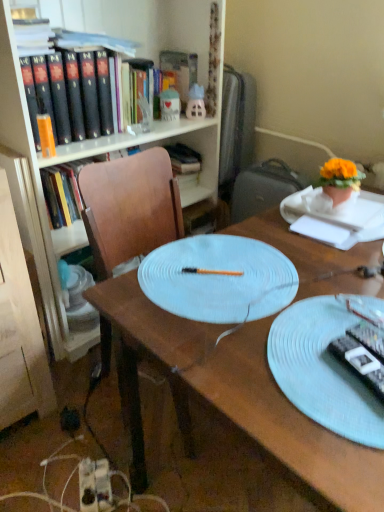
Question: Can you confirm if black plastic remote control at right, the first remote control from the right, is thinner than black plastic remote control at lower right, which appears as the second remote control when viewed from the right?

Choices:
 (A) no
 (B) yes

Answer: (B)

Question: Can you confirm if black plastic remote control at right, the first remote control from the right, is taller than black plastic remote control at lower right, which appears as the second remote control when viewed from the right?

Choices:
 (A) yes
 (B) no

Answer: (A)

Question: Is black plastic remote control at right, arranged as the 2th remote control when viewed from the left, smaller than black plastic remote control at lower right, which appears as the second remote control when viewed from the right?

Choices:
 (A) yes
 (B) no

Answer: (B)

Question: Does black plastic remote control at right, the first remote control from the right, lie in front of black plastic remote control at lower right, the 1th remote control positioned from the left?

Choices:
 (A) no
 (B) yes

Answer: (A)

Question: From the image's perspective, is black plastic remote control at right, the first remote control from the right, on black plastic remote control at lower right, the 1th remote control positioned from the left?

Choices:
 (A) no
 (B) yes

Answer: (B)

Question: Is black plastic remote control at right, the first remote control from the right, facing towards black plastic remote control at lower right, which appears as the second remote control when viewed from the right?

Choices:
 (A) no
 (B) yes

Answer: (B)

Question: Is orange fabric flower pot at upper right bigger than wooden desk at center?

Choices:
 (A) yes
 (B) no

Answer: (B)

Question: Is the position of orange fabric flower pot at upper right more distant than that of wooden desk at center?

Choices:
 (A) yes
 (B) no

Answer: (A)

Question: Is orange fabric flower pot at upper right with wooden desk at center?

Choices:
 (A) yes
 (B) no

Answer: (B)

Question: Can you confirm if orange fabric flower pot at upper right is taller than wooden desk at center?

Choices:
 (A) yes
 (B) no

Answer: (B)

Question: Considering the relative sizes of orange fabric flower pot at upper right and wooden desk at center in the image provided, is orange fabric flower pot at upper right wider than wooden desk at center?

Choices:
 (A) yes
 (B) no

Answer: (B)

Question: Can you confirm if orange fabric flower pot at upper right is positioned to the left of wooden desk at center?

Choices:
 (A) yes
 (B) no

Answer: (B)

Question: Can you confirm if matte wood bookcase at upper left is shorter than matte pink plastic toy at upper center, which is counted as the first toy, starting from the right?

Choices:
 (A) yes
 (B) no

Answer: (B)